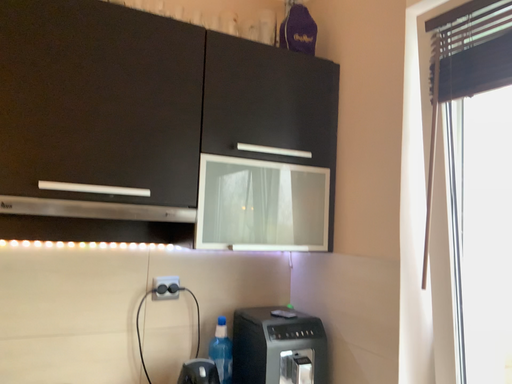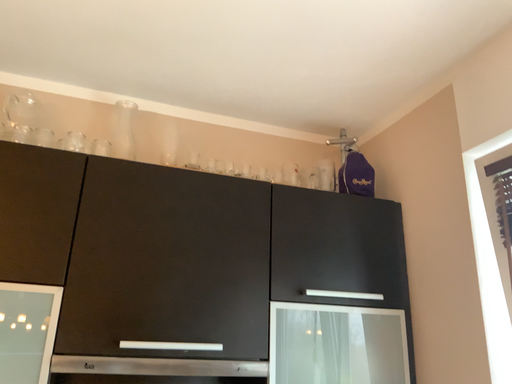
Question: How did the camera likely rotate when shooting the video?

Choices:
 (A) rotated upward
 (B) rotated downward

Answer: (A)